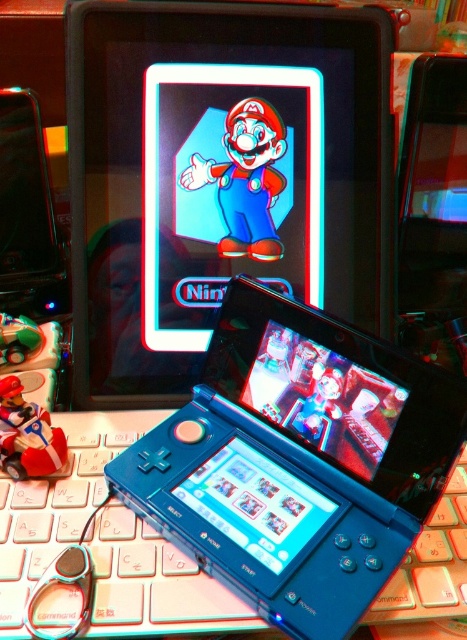
You are organizing a display and need to place the blue plastic laptop at center and the matte red figure at lower left. According to the scene, which object is closer to the viewer?

The blue plastic laptop at center is closer to the viewer than the matte red figure at lower left.

You are setting up a display for a video game convention. You have a matte blue nintendo ds at center and a matte red figure at lower left. Which object should you place higher on the shelf to ensure stability?

The matte blue nintendo ds at center is taller than the matte red figure at lower left, so it should be placed higher on the shelf to ensure stability.

In the scene shown: You are holding a ruler and want to measure the distance from your eye to the point at coordinates point [56,550]. If the ruler is 12 inches long, can you reach that point with the ruler?

The point [56,550] is 19.51 inches from the camera, so the ruler is too short to reach that distance.